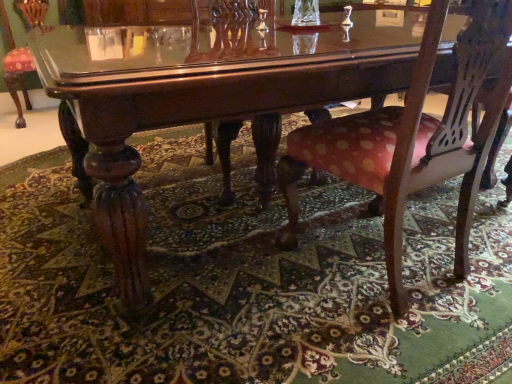
Question: Can you confirm if polka dot fabric chair at center is shorter than carpeted floor at center?

Choices:
 (A) no
 (B) yes

Answer: (A)

Question: Is polka dot fabric chair at center directly adjacent to carpeted floor at center?

Choices:
 (A) no
 (B) yes

Answer: (A)

Question: Is polka dot fabric chair at center surrounding carpeted floor at center?

Choices:
 (A) yes
 (B) no

Answer: (B)

Question: Can you confirm if polka dot fabric chair at center is wider than carpeted floor at center?

Choices:
 (A) no
 (B) yes

Answer: (A)

Question: Considering the relative positions of polka dot fabric chair at center and carpeted floor at center in the image provided, is polka dot fabric chair at center to the left of carpeted floor at center from the viewer's perspective?

Choices:
 (A) no
 (B) yes

Answer: (A)

Question: Is polka dot fabric chair at center at the right side of carpeted floor at center?

Choices:
 (A) yes
 (B) no

Answer: (A)

Question: Are carpeted floor at center and polka dot fabric chair at center beside each other?

Choices:
 (A) no
 (B) yes

Answer: (A)

Question: Is carpeted floor at center thinner than polka dot fabric chair at center?

Choices:
 (A) no
 (B) yes

Answer: (A)

Question: From a real-world perspective, is carpeted floor at center under polka dot fabric chair at center?

Choices:
 (A) no
 (B) yes

Answer: (B)

Question: Considering the relative sizes of carpeted floor at center and polka dot fabric chair at center in the image provided, is carpeted floor at center wider than polka dot fabric chair at center?

Choices:
 (A) no
 (B) yes

Answer: (B)

Question: From the image's perspective, is carpeted floor at center beneath polka dot fabric chair at center?

Choices:
 (A) yes
 (B) no

Answer: (A)

Question: Does carpeted floor at center have a larger size compared to polka dot fabric chair at center?

Choices:
 (A) yes
 (B) no

Answer: (A)

Question: In terms of height, does polka dot fabric chair at center look taller or shorter compared to carpeted floor at center?

Choices:
 (A) tall
 (B) short

Answer: (A)